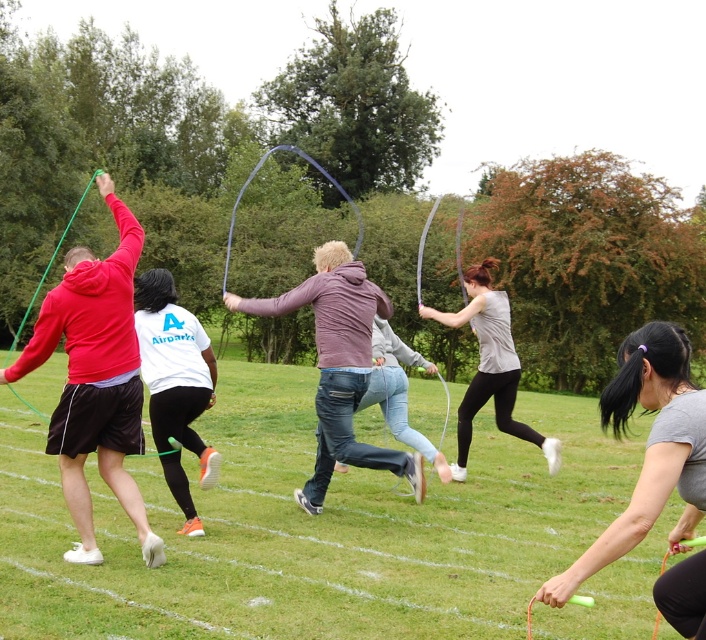
Does green rubber jump rope at center have a greater height compared to white matte t-shirt at center?

No, green rubber jump rope at center is not taller than white matte t-shirt at center.

Can you confirm if green rubber jump rope at center is positioned above white matte t-shirt at center?

No, green rubber jump rope at center is not above white matte t-shirt at center.

Is point (573, 632) farther from viewer compared to point (152, 410)?

No, it is not.

What are the coordinates of `green rubber jump rope at center` in the screenshot? It's located at (309, 529).

Between green rubber jump rope at center and matte red hoodie at left, which one appears on the right side from the viewer's perspective?

green rubber jump rope at center is more to the right.

Is green rubber jump rope at center shorter than matte red hoodie at left?

No.

This screenshot has width=706, height=640. Describe the element at coordinates (309, 529) in the screenshot. I see `green rubber jump rope at center` at that location.

This screenshot has height=640, width=706. I want to click on green rubber jump rope at center, so click(309, 529).

Is green rubber jump rope at center to the left of matte gray tank top at center from the viewer's perspective?

Indeed, green rubber jump rope at center is positioned on the left side of matte gray tank top at center.

Image resolution: width=706 pixels, height=640 pixels. What do you see at coordinates (309, 529) in the screenshot? I see `green rubber jump rope at center` at bounding box center [309, 529].

Where is `green rubber jump rope at center`? green rubber jump rope at center is located at coordinates (309, 529).